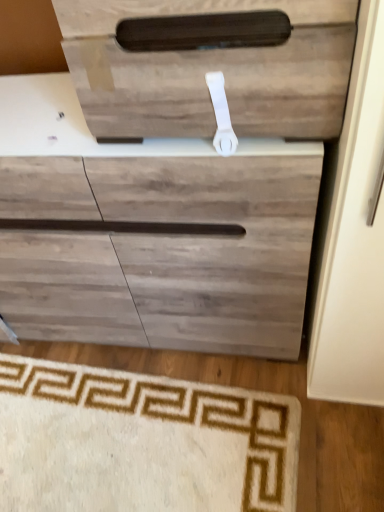
Question: Relative to wooden drawer at upper center, is beige carpet at lower left in front or behind?

Choices:
 (A) front
 (B) behind

Answer: (B)

Question: Is point (31, 446) closer or farther from the camera than point (150, 60)?

Choices:
 (A) closer
 (B) farther

Answer: (B)

Question: Which is farther from the wooden drawer at upper center?

Choices:
 (A) beige carpet at lower left
 (B) white plastic door handle at upper center

Answer: (A)

Question: Which of these objects is positioned closest to the beige carpet at lower left?

Choices:
 (A) wooden drawer at upper center
 (B) white plastic door handle at upper center

Answer: (B)